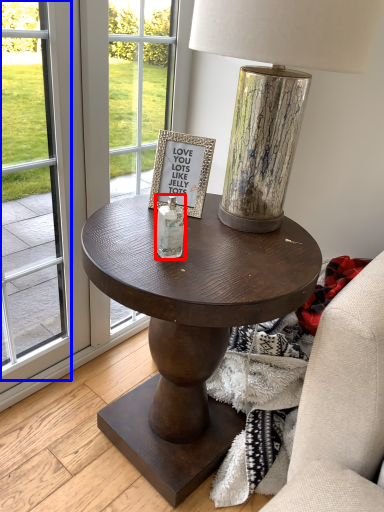
Question: Which object is closer to the camera taking this photo, bottle (highlighted by a red box) or screen door (highlighted by a blue box)?

Choices:
 (A) bottle
 (B) screen door

Answer: (B)